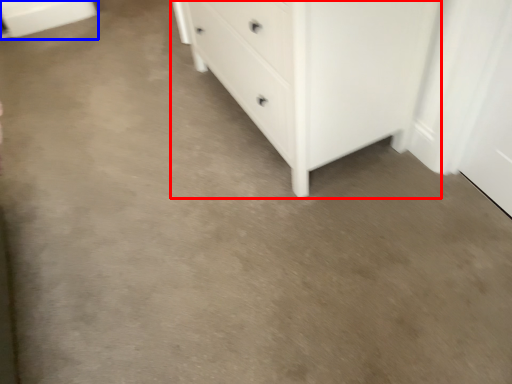
Question: Which object appears closest to the camera in this image, chest of drawers (highlighted by a red box) or cabinetry (highlighted by a blue box)?

Choices:
 (A) chest of drawers
 (B) cabinetry

Answer: (A)